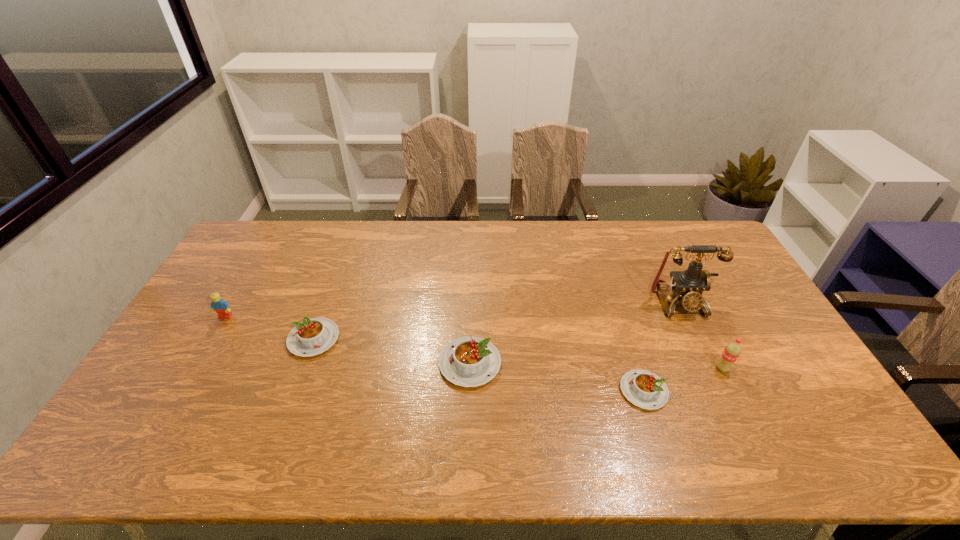
You are a GUI agent. You are given a task and a screenshot of the screen. Output one action in this format:
    pyautogui.click(x=<x>, y=<y>)
    Task: Click on the free space located 0.240m on the right of the fourth object from right to left
    
    Given the screenshot: What is the action you would take?
    pyautogui.click(x=587, y=363)

Where is `blank area located 0.240m on the right of the rightmost pudding`? Image resolution: width=960 pixels, height=540 pixels. blank area located 0.240m on the right of the rightmost pudding is located at coordinates (757, 391).

You are a GUI agent. You are given a task and a screenshot of the screen. Output one action in this format:
    pyautogui.click(x=<x>, y=<y>)
    Task: Click on the vacant space located on the front of the telephone, featuring the rotary dial
    This screenshot has width=960, height=540.
    Given the screenshot: What is the action you would take?
    pyautogui.click(x=698, y=345)

Where is `vacant point located on the face of the fourth shortest object`? This screenshot has height=540, width=960. vacant point located on the face of the fourth shortest object is located at coordinates (174, 406).

You are a GUI agent. You are given a task and a screenshot of the screen. Output one action in this format:
    pyautogui.click(x=<x>, y=<y>)
    Task: Click on the free space located 0.130m on the left of the second tallest object
    This screenshot has height=540, width=960.
    Given the screenshot: What is the action you would take?
    pyautogui.click(x=669, y=369)

The height and width of the screenshot is (540, 960). Identify the location of object present at the near edge. (644, 389).

You are a GUI agent. You are given a task and a screenshot of the screen. Output one action in this format:
    pyautogui.click(x=<x>, y=<y>)
    Task: Click on the object that is at the left edge
    
    Given the screenshot: What is the action you would take?
    pyautogui.click(x=218, y=304)

Identify the location of object at the right edge. Image resolution: width=960 pixels, height=540 pixels. (687, 286).

Locate an element on the screen. The image size is (960, 540). vacant space at the far edge of the desktop is located at coordinates (381, 252).

Image resolution: width=960 pixels, height=540 pixels. I want to click on vacant space at the near edge of the desktop, so click(708, 394).